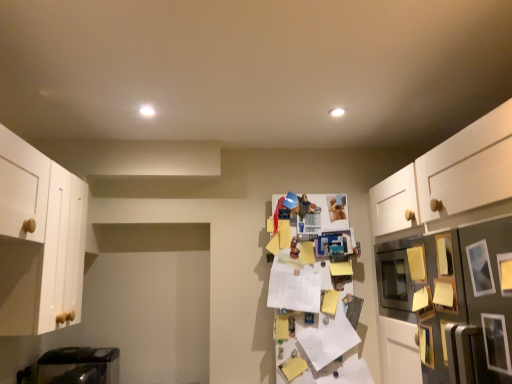
Question: Considering the positions of wooden picture frame at lower right, arranged as the first picture frame when viewed from the back, and metallic silver picture frame at right, which appears as the second picture frame when viewed from the front, in the image, is wooden picture frame at lower right, arranged as the first picture frame when viewed from the back, bigger or smaller than metallic silver picture frame at right, which appears as the second picture frame when viewed from the front,?

Choices:
 (A) big
 (B) small

Answer: (A)

Question: From a real-world perspective, relative to metallic silver picture frame at right, the 4th picture frame positioned from the back, is wooden picture frame at lower right, arranged as the first picture frame when viewed from the back, vertically above or below?

Choices:
 (A) above
 (B) below

Answer: (B)

Question: Which of these objects is positioned closest to the yellow paper at center, the second shelf when ordered from front to back?

Choices:
 (A) wooden picture frame at right, acting as the 4th picture frame starting from the front
 (B) metallic silver picture frame at right, the third picture frame positioned from the front
 (C) white matte cabinet at left
 (D) metallic silver refrigerator at right, arranged as the second shelf when viewed from the left
 (E) wooden picture frame at lower right, which is the fifth picture frame from front to back

Answer: (E)

Question: Which object is positioned closest to the white matte cabinet at left?

Choices:
 (A) metallic silver picture frame at right, which appears as the second picture frame when viewed from the front
 (B) wooden picture frame at lower right, which is the fifth picture frame from front to back
 (C) wooden picture frame at right, the fifth picture frame viewed from the back
 (D) metallic silver refrigerator at right, arranged as the 1th shelf when viewed from the front
 (E) metallic silver picture frame at right, the third picture frame positioned from the front

Answer: (D)